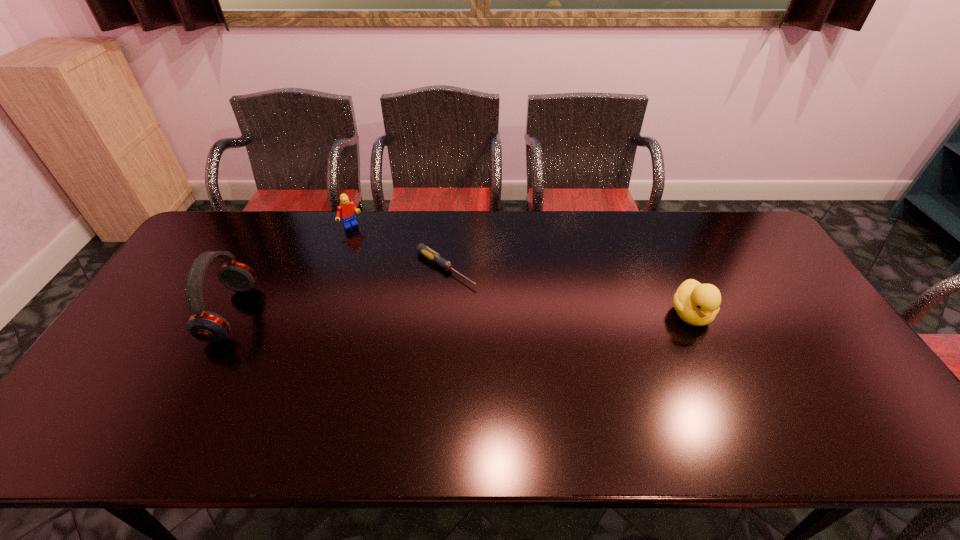
I want to click on vacant space on the desktop that is between the tallest object and the duck and is positioned insert the second object from right to left into a screw head, so click(515, 314).

You are a GUI agent. You are given a task and a screenshot of the screen. Output one action in this format:
    pyautogui.click(x=<x>, y=<y>)
    Task: Click on the free space on the desktop that is between the leftmost object and the rightmost object and is positioned on the front-facing side of the farthest object
    
    Given the screenshot: What is the action you would take?
    click(423, 314)